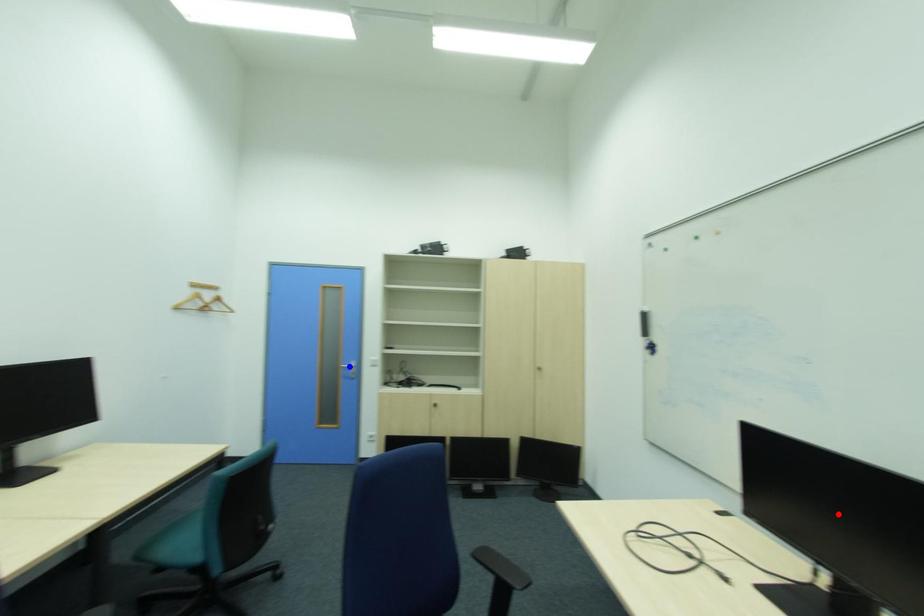
Question: Two points are marked on the image. Which point is closer to the camera?

Choices:
 (A) Blue point is closer.
 (B) Red point is closer.

Answer: (B)